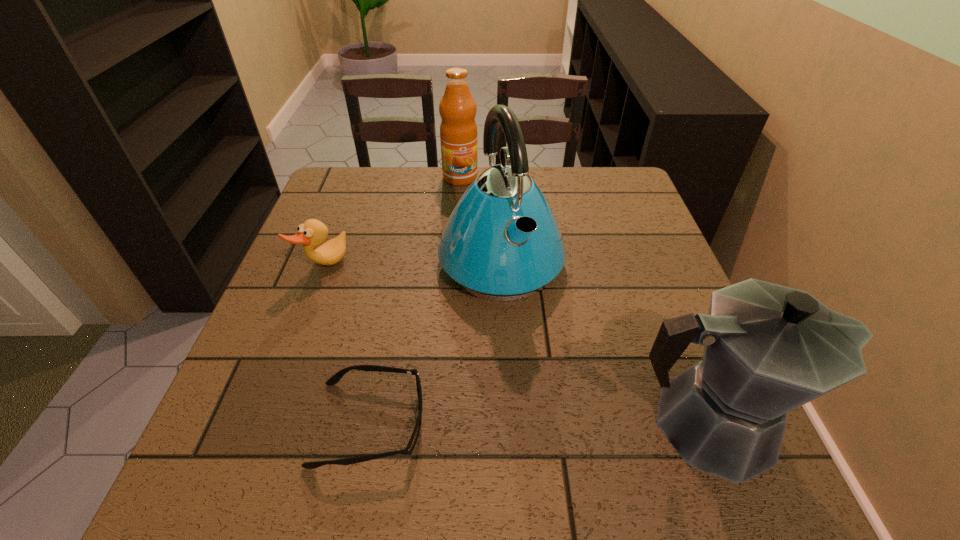
Where is `empty space between the duck and the rightmost object`? The height and width of the screenshot is (540, 960). empty space between the duck and the rightmost object is located at coordinates (515, 345).

Find the location of a particular element. This screenshot has height=540, width=960. empty space that is in between the spectacles and the fruit juice is located at coordinates (415, 300).

Locate an element on the screen. The image size is (960, 540). free space that is in between the rightmost object and the fourth tallest object is located at coordinates (515, 345).

This screenshot has height=540, width=960. I want to click on unoccupied position between the fruit juice and the coffeepot, so click(x=583, y=301).

Image resolution: width=960 pixels, height=540 pixels. In order to click on free point between the fourth tallest object and the spectacles in this screenshot , I will do `click(347, 345)`.

This screenshot has height=540, width=960. Identify the location of free area in between the shortest object and the coffeepot. (538, 424).

Where is `the fourth closest object to the farthest object`? Image resolution: width=960 pixels, height=540 pixels. the fourth closest object to the farthest object is located at coordinates pos(768,349).

Where is `object that ranks as the closest to the kettle`? The image size is (960, 540). object that ranks as the closest to the kettle is located at coordinates (458, 130).